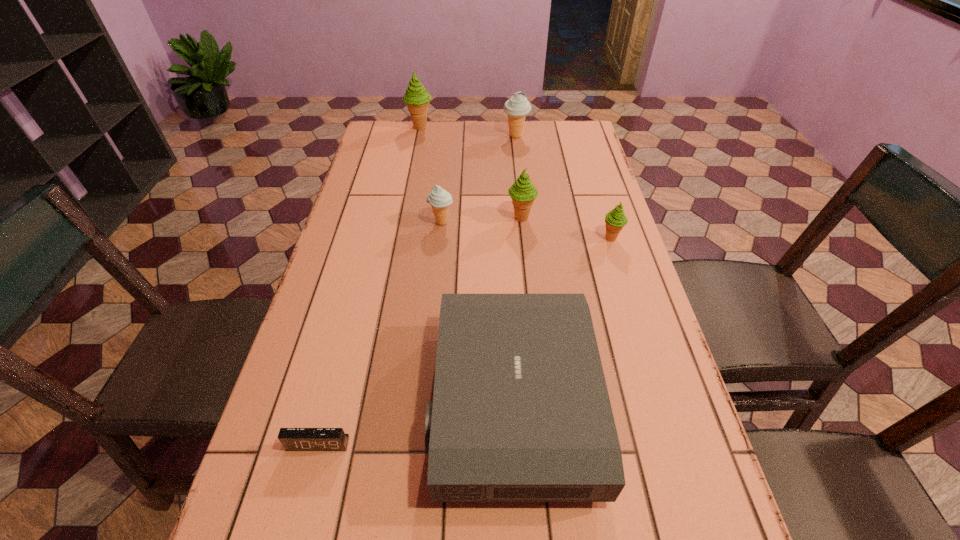
Where is `vacant area situated on the front-facing side of the shortest object`? This screenshot has height=540, width=960. vacant area situated on the front-facing side of the shortest object is located at coordinates (298, 523).

What are the coordinates of `icecream at the left edge` in the screenshot? It's located at (416, 97).

Find the location of `alarm clock that is at the left edge`. alarm clock that is at the left edge is located at coordinates (293, 439).

Image resolution: width=960 pixels, height=540 pixels. I want to click on object that is at the right edge, so click(615, 220).

Find the location of `object that is at the far left corner`. object that is at the far left corner is located at coordinates (416, 97).

Where is `free region at the far edge of the desktop`? Image resolution: width=960 pixels, height=540 pixels. free region at the far edge of the desktop is located at coordinates (542, 150).

I want to click on vacant space at the left edge, so click(x=378, y=178).

The height and width of the screenshot is (540, 960). I want to click on blank area at the right edge, so click(712, 533).

Locate an element on the screen. The width and height of the screenshot is (960, 540). vacant space at the far left corner of the desktop is located at coordinates (396, 126).

Locate an element on the screen. This screenshot has height=540, width=960. vacant space at the far right corner of the desktop is located at coordinates (548, 150).